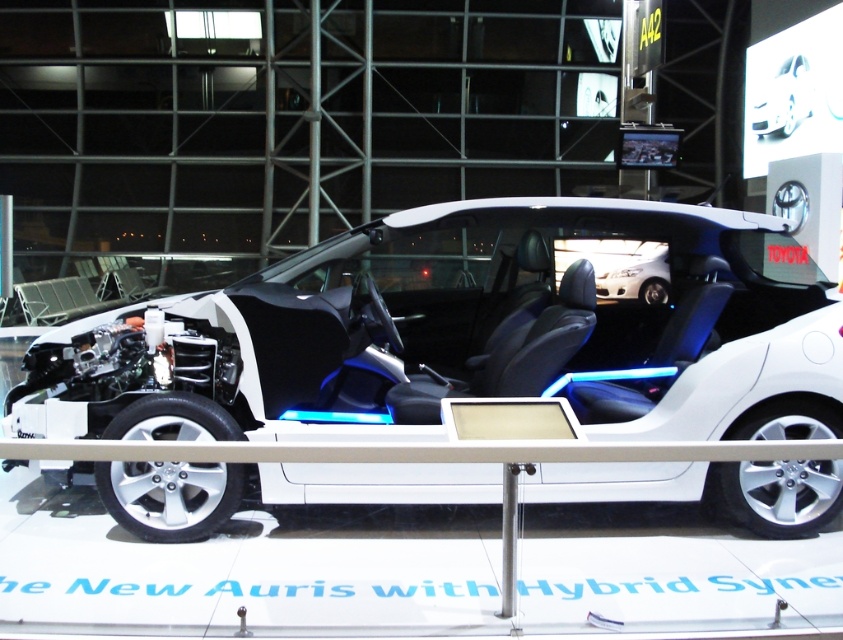
Question: Observing the image, what is the correct spatial positioning of white matte concept car at center in reference to white matte car at center?

Choices:
 (A) above
 (B) below

Answer: (B)

Question: From the image, what is the correct spatial relationship of white matte concept car at center in relation to white matte car at center?

Choices:
 (A) left
 (B) right

Answer: (A)

Question: Can you confirm if white matte concept car at center is wider than white matte car at center?

Choices:
 (A) yes
 (B) no

Answer: (A)

Question: Which object appears closest to the camera in this image?

Choices:
 (A) white matte car at center
 (B) white matte concept car at center

Answer: (B)

Question: Which point appears farthest from the camera in this image?

Choices:
 (A) (780, 99)
 (B) (519, 307)

Answer: (A)

Question: Among these points, which one is nearest to the camera?

Choices:
 (A) (89, 369)
 (B) (781, 65)

Answer: (A)